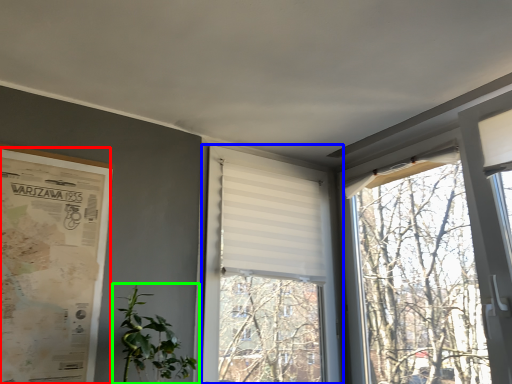
Question: Estimate the real-world distances between objects in this image. Which object is closer to poster page (highlighted by a red box), window (highlighted by a blue box) or houseplant (highlighted by a green box)?

Choices:
 (A) window
 (B) houseplant

Answer: (B)